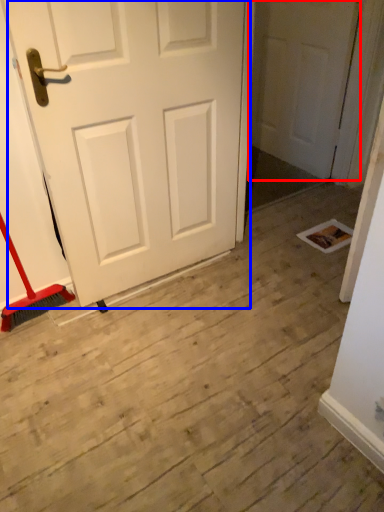
Question: Which object appears farthest to the camera in this image, door (highlighted by a red box) or door (highlighted by a blue box)?

Choices:
 (A) door
 (B) door

Answer: (A)